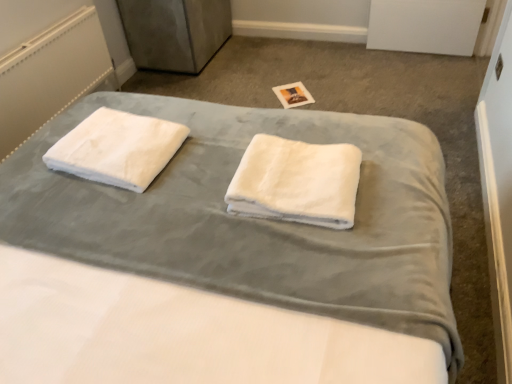
Question: Is white soft towel at left, the 1th towel viewed from the left, to the left of white soft towels at center from the viewer's perspective?

Choices:
 (A) yes
 (B) no

Answer: (A)

Question: Are white soft towel at left, which is the 2th towel from right to left, and white soft towels at center far apart?

Choices:
 (A) no
 (B) yes

Answer: (A)

Question: Does white soft towel at left, which is the 2th towel from right to left, have a lesser height compared to white soft towels at center?

Choices:
 (A) yes
 (B) no

Answer: (A)

Question: Does white soft towel at left, the 1th towel viewed from the left, turn towards white soft towels at center?

Choices:
 (A) yes
 (B) no

Answer: (A)

Question: From the image's perspective, is white soft towel at left, which is the 2th towel from right to left, below white soft towels at center?

Choices:
 (A) no
 (B) yes

Answer: (A)

Question: Is white soft towel at left, the 1th towel viewed from the left, spatially inside white fabric radiator at upper left, or outside of it?

Choices:
 (A) inside
 (B) outside

Answer: (B)

Question: In the image, is white soft towel at left, which is the 2th towel from right to left, positioned in front of or behind white fabric radiator at upper left?

Choices:
 (A) front
 (B) behind

Answer: (A)

Question: Would you say white soft towel at left, which is the 2th towel from right to left, is to the left or to the right of white fabric radiator at upper left in the picture?

Choices:
 (A) left
 (B) right

Answer: (B)

Question: In terms of width, does white soft towel at left, the 1th towel viewed from the left, look wider or thinner when compared to white fabric radiator at upper left?

Choices:
 (A) thin
 (B) wide

Answer: (B)

Question: In terms of size, does white soft towel at left, which is the 2th towel from right to left, appear bigger or smaller than white soft towels at center?

Choices:
 (A) big
 (B) small

Answer: (B)

Question: From the image's perspective, is white soft towel at left, the 1th towel viewed from the left, above or below white soft towels at center?

Choices:
 (A) above
 (B) below

Answer: (A)

Question: Is point (102, 137) positioned closer to the camera than point (92, 248)?

Choices:
 (A) closer
 (B) farther

Answer: (B)

Question: Is white soft towel at left, which is the 2th towel from right to left, taller or shorter than white soft towels at center?

Choices:
 (A) short
 (B) tall

Answer: (A)

Question: Is white soft towel at left, which is the 2th towel from right to left, bigger or smaller than white fluffy towel at center, the 2th towel positioned from the left?

Choices:
 (A) big
 (B) small

Answer: (B)

Question: Considering the positions of point (173, 132) and point (318, 148), is point (173, 132) closer or farther from the camera than point (318, 148)?

Choices:
 (A) farther
 (B) closer

Answer: (A)